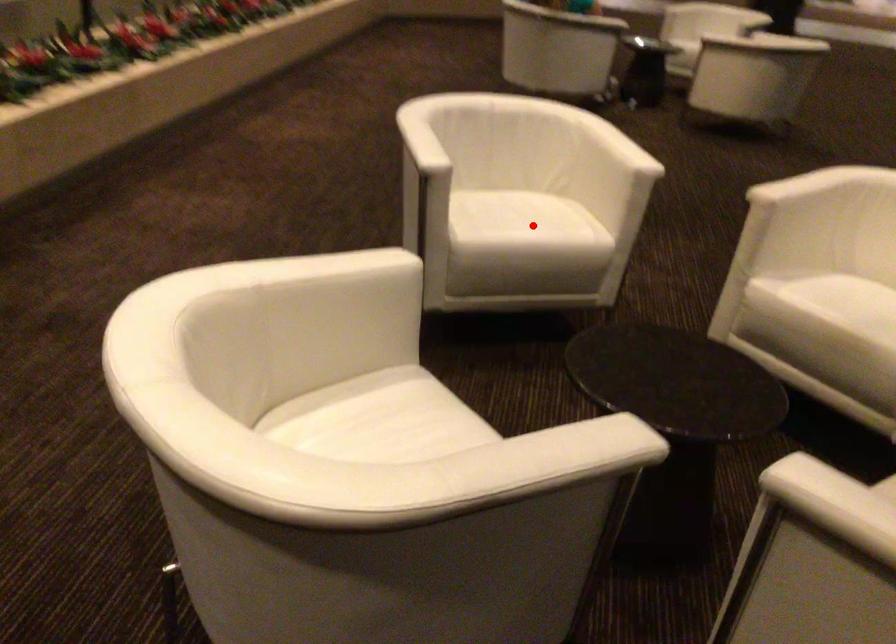
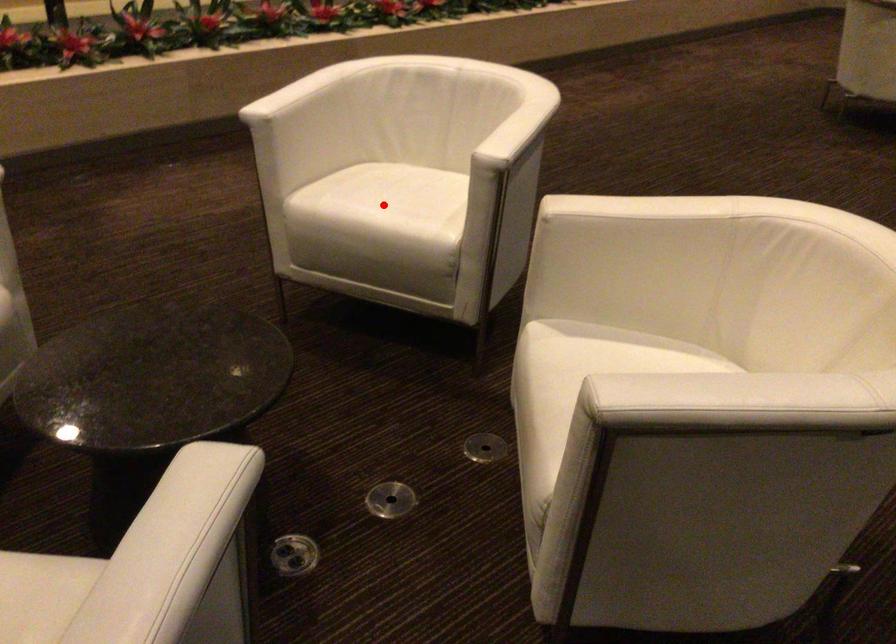
I am providing you with two images of the same scene from different viewpoints. A red point is marked on the first image and another point is marked on the second image. Is the red point in image1 aligned with the point shown in image2?

Yes